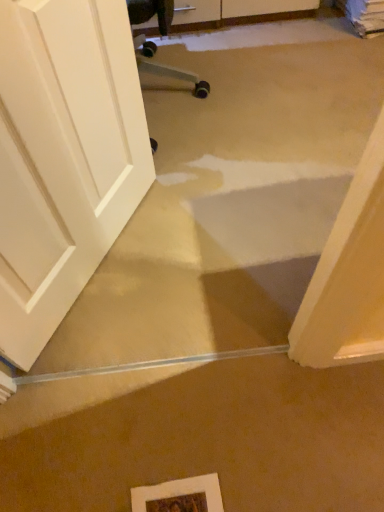
Question: Is white matte picture frame at lower center bigger or smaller than white matte door at left?

Choices:
 (A) big
 (B) small

Answer: (B)

Question: From the image's perspective, is white matte picture frame at lower center located above or below white matte door at left?

Choices:
 (A) above
 (B) below

Answer: (B)

Question: Considering the positions of point (206, 490) and point (39, 103), is point (206, 490) closer or farther from the camera than point (39, 103)?

Choices:
 (A) closer
 (B) farther

Answer: (B)

Question: Considering their positions, is white matte door at left located in front of or behind white matte picture frame at lower center?

Choices:
 (A) behind
 (B) front

Answer: (B)

Question: From the image's perspective, is white matte door at left above or below white matte picture frame at lower center?

Choices:
 (A) below
 (B) above

Answer: (B)

Question: Based on their positions, is white matte door at left located to the left or right of white matte picture frame at lower center?

Choices:
 (A) left
 (B) right

Answer: (A)

Question: Considering the positions of white matte door at left and white matte picture frame at lower center in the image, is white matte door at left wider or thinner than white matte picture frame at lower center?

Choices:
 (A) thin
 (B) wide

Answer: (A)